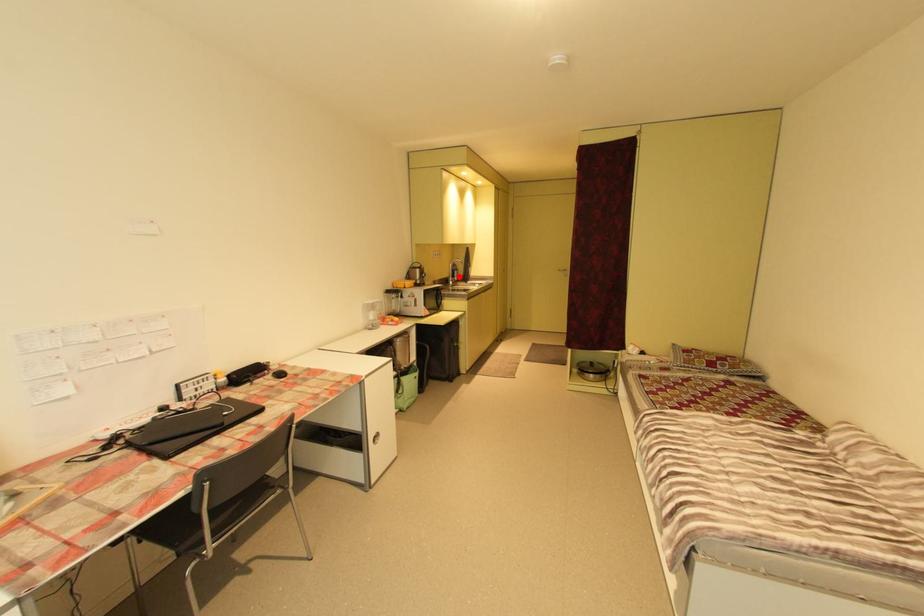
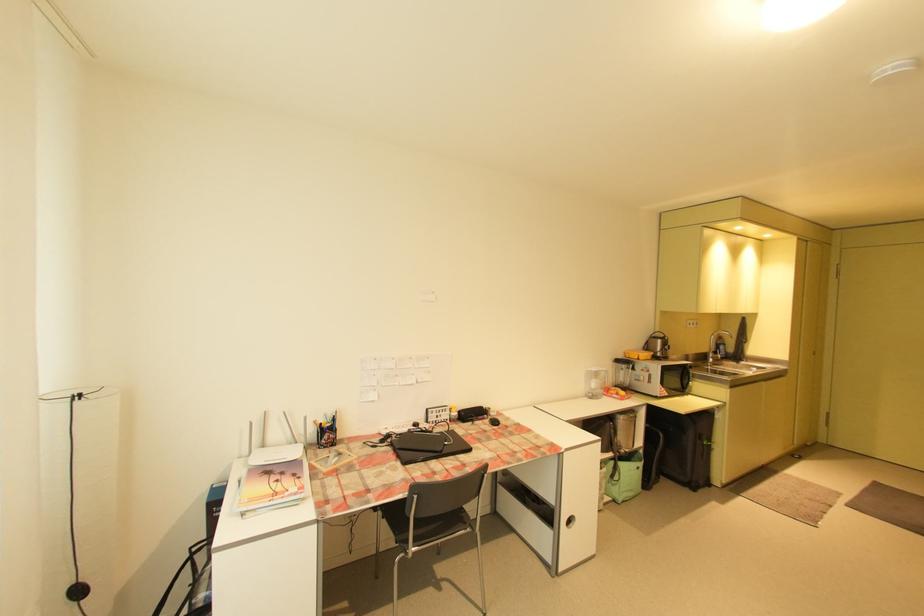
Question: A red point is marked in image1. In image2, is the corresponding 3D point closer to the camera or farther? Reply with the corresponding letter.

Choices:
 (A) The corresponding 3D point is closer.
 (B) The corresponding 3D point is farther.

Answer: (B)